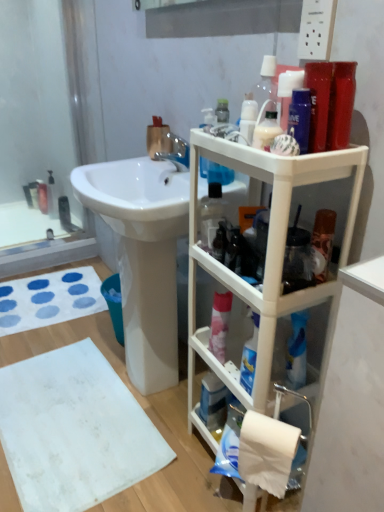
Question: Would you consider white plastic shelf at right to be distant from translucent plastic bottle at upper center?

Choices:
 (A) no
 (B) yes

Answer: (A)

Question: Considering the relative sizes of white plastic shelf at right and translucent plastic bottle at upper center in the image provided, is white plastic shelf at right smaller than translucent plastic bottle at upper center?

Choices:
 (A) yes
 (B) no

Answer: (B)

Question: Is white plastic shelf at right taller than translucent plastic bottle at upper center?

Choices:
 (A) yes
 (B) no

Answer: (A)

Question: Is the surface of white plastic shelf at right in direct contact with translucent plastic bottle at upper center?

Choices:
 (A) no
 (B) yes

Answer: (A)

Question: Is the position of white plastic shelf at right more distant than that of translucent plastic bottle at upper center?

Choices:
 (A) yes
 (B) no

Answer: (B)

Question: Looking at the image, does clear glass bottle at upper left seem bigger or smaller compared to white plastic shelf at right?

Choices:
 (A) small
 (B) big

Answer: (A)

Question: From the image's perspective, is clear glass bottle at upper left located above or below white plastic shelf at right?

Choices:
 (A) below
 (B) above

Answer: (B)

Question: Is clear glass bottle at upper left wider or thinner than white plastic shelf at right?

Choices:
 (A) wide
 (B) thin

Answer: (A)

Question: From a real-world perspective, relative to white plastic shelf at right, is clear glass bottle at upper left vertically above or below?

Choices:
 (A) above
 (B) below

Answer: (B)

Question: In the image, is white matte toilet paper at lower right on the left side or the right side of white fabric bath towel at lower left, the 2th bath towel when ordered from front to back?

Choices:
 (A) right
 (B) left

Answer: (A)

Question: Looking at their shapes, would you say white matte toilet paper at lower right is wider or thinner than white fabric bath towel at lower left, the 2th bath towel when ordered from front to back?

Choices:
 (A) thin
 (B) wide

Answer: (A)

Question: Based on their sizes in the image, would you say white matte toilet paper at lower right is bigger or smaller than white fabric bath towel at lower left, which is the first bath towel from top to bottom?

Choices:
 (A) small
 (B) big

Answer: (A)

Question: Is point (266, 417) closer or farther from the camera than point (56, 276)?

Choices:
 (A) farther
 (B) closer

Answer: (B)

Question: Is white matte bath towel at lower left, marked as the 2th bath towel in a top-to-bottom arrangement, taller or shorter than white plastic shelf at right?

Choices:
 (A) short
 (B) tall

Answer: (A)

Question: Looking at the image, does white matte bath towel at lower left, the first bath towel in the front-to-back sequence, seem bigger or smaller compared to white plastic shelf at right?

Choices:
 (A) big
 (B) small

Answer: (B)